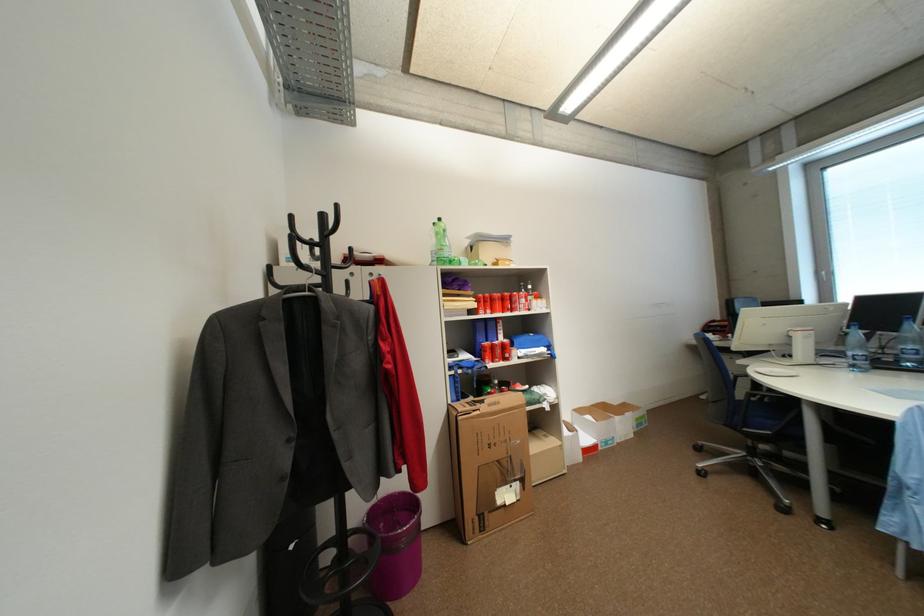
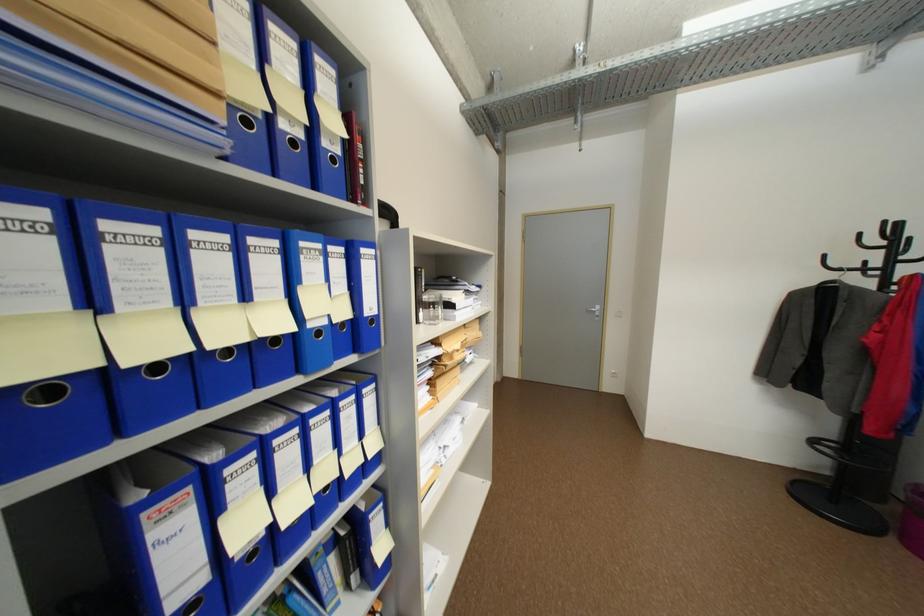
The point at (346, 207) is marked in the first image. Where is the corresponding point in the second image?

(893, 224)